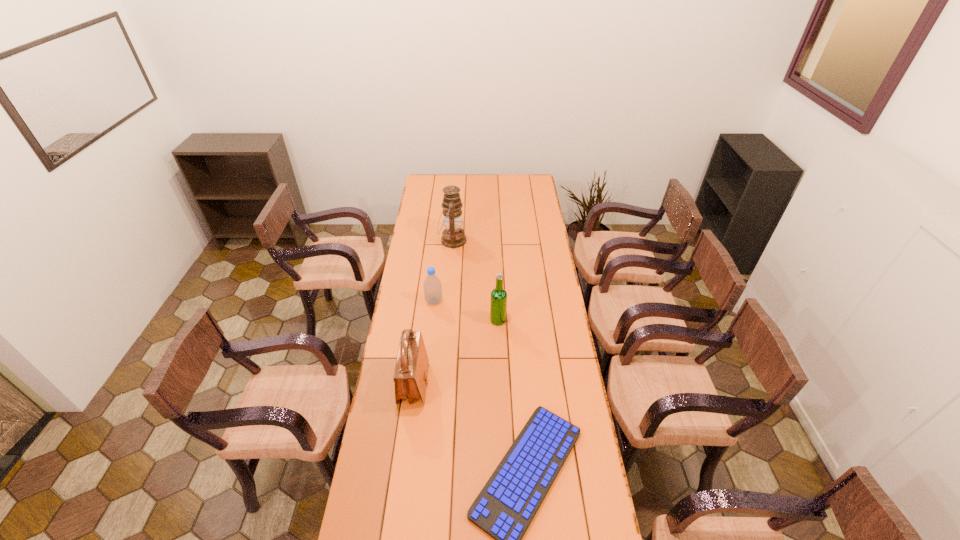
The height and width of the screenshot is (540, 960). I want to click on lantern, so click(x=453, y=236).

Locate an element on the screen. the farthest object is located at coordinates (453, 236).

This screenshot has height=540, width=960. I want to click on shoulder bag, so point(411,372).

Identify the location of beer bottle. The height and width of the screenshot is (540, 960). (498, 300).

Identify the location of the second farthest object. (432, 285).

Locate an element on the screen. Image resolution: width=960 pixels, height=540 pixels. bottle is located at coordinates (432, 285).

Locate an element on the screen. This screenshot has height=540, width=960. vacant space located on the back of the lantern is located at coordinates (456, 196).

This screenshot has height=540, width=960. I want to click on vacant area located 0.090m on the front flap of the second nearest object, so click(451, 384).

Image resolution: width=960 pixels, height=540 pixels. What are the coordinates of `free spot located 0.200m on the left of the third nearest object` in the screenshot? It's located at (445, 320).

You are a GUI agent. You are given a task and a screenshot of the screen. Output one action in this format:
    pyautogui.click(x=<x>, y=<y>)
    Task: Click on the free space located on the right of the fourth tallest object
    
    Given the screenshot: What is the action you would take?
    pyautogui.click(x=503, y=301)